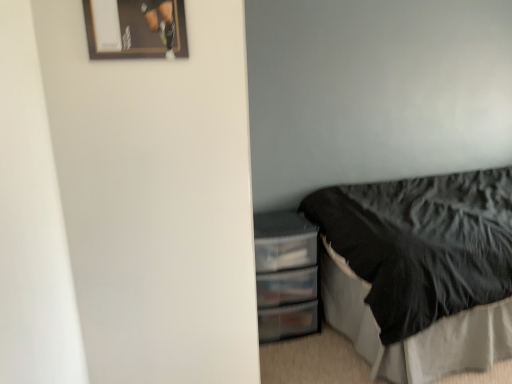
This screenshot has height=384, width=512. Find the location of `transparent plastic drawers at lower right`. transparent plastic drawers at lower right is located at coordinates (286, 275).

Looking at this image, measure the distance between transparent plastic drawers at lower right and camera.

A distance of 2.10 meters exists between transparent plastic drawers at lower right and camera.

I want to click on transparent plastic drawers at lower right, so click(x=286, y=275).

Find the location of a particular element. This screenshot has height=384, width=512. picture frame located in front of the transparent plastic drawers at lower right is located at coordinates (136, 29).

From a real-world perspective, who is located lower, transparent plastic drawers at lower right or wooden framed poster at upper left?

transparent plastic drawers at lower right is physically lower.

Which point is more forward, [298,223] or [105,29]?

Positioned in front is point [105,29].

Is wooden framed poster at upper left located within transparent plastic drawers at lower right?

No, wooden framed poster at upper left is located outside of transparent plastic drawers at lower right.

Which of these two, black feathered bed at lower right or wooden framed poster at upper left, is thinner?

wooden framed poster at upper left.

Considering the relative sizes of black feathered bed at lower right and wooden framed poster at upper left in the image provided, is black feathered bed at lower right bigger than wooden framed poster at upper left?

Yes, black feathered bed at lower right is bigger than wooden framed poster at upper left.

Considering the relative sizes of black feathered bed at lower right and wooden framed poster at upper left in the image provided, is black feathered bed at lower right shorter than wooden framed poster at upper left?

No.

From the image's perspective, between black feathered bed at lower right and transparent plastic drawers at lower right, who is located below?

transparent plastic drawers at lower right.

Does black feathered bed at lower right have a smaller size compared to transparent plastic drawers at lower right?

Incorrect, black feathered bed at lower right is not smaller in size than transparent plastic drawers at lower right.

Does black feathered bed at lower right touch transparent plastic drawers at lower right?

No, black feathered bed at lower right is not in contact with transparent plastic drawers at lower right.

Can you confirm if black feathered bed at lower right is positioned to the right of transparent plastic drawers at lower right?

Indeed, black feathered bed at lower right is positioned on the right side of transparent plastic drawers at lower right.

Is wooden framed poster at upper left spatially inside black feathered bed at lower right, or outside of it?

wooden framed poster at upper left is not enclosed by black feathered bed at lower right.

Which is more to the left, wooden framed poster at upper left or black feathered bed at lower right?

wooden framed poster at upper left is more to the left.

Is wooden framed poster at upper left oriented away from black feathered bed at lower right?

No, black feathered bed at lower right is not at the back of wooden framed poster at upper left.

Which is closer, (102,39) or (482,264)?

The point (102,39) is more forward.

Locate an element on the screen. This screenshot has width=512, height=384. file cabinet below the wooden framed poster at upper left (from a real-world perspective) is located at coordinates (286, 275).

Is there a large distance between wooden framed poster at upper left and transparent plastic drawers at lower right?

Absolutely, wooden framed poster at upper left is distant from transparent plastic drawers at lower right.

Could you tell me if wooden framed poster at upper left is facing transparent plastic drawers at lower right?

No, wooden framed poster at upper left is not facing towards transparent plastic drawers at lower right.

Between wooden framed poster at upper left and transparent plastic drawers at lower right, which one has larger width?

transparent plastic drawers at lower right.

From the picture: From the image's perspective, is transparent plastic drawers at lower right below black feathered bed at lower right?

Yes.

From a real-world perspective, relative to black feathered bed at lower right, is transparent plastic drawers at lower right vertically above or below?

transparent plastic drawers at lower right is below black feathered bed at lower right.

How different are the orientations of transparent plastic drawers at lower right and black feathered bed at lower right in degrees?

transparent plastic drawers at lower right and black feathered bed at lower right are facing 87.1 degrees away from each other.

This screenshot has height=384, width=512. In order to click on picture frame above the transparent plastic drawers at lower right (from a real-world perspective) in this screenshot , I will do `click(136, 29)`.

This screenshot has height=384, width=512. Find the location of `bed on the right of wooden framed poster at upper left`. bed on the right of wooden framed poster at upper left is located at coordinates (421, 271).

Which object lies further to the anchor point transparent plastic drawers at lower right, wooden framed poster at upper left or black feathered bed at lower right?

wooden framed poster at upper left is positioned further to the anchor transparent plastic drawers at lower right.

Which object lies nearer to the anchor point wooden framed poster at upper left, black feathered bed at lower right or transparent plastic drawers at lower right?

Among the two, transparent plastic drawers at lower right is located nearer to wooden framed poster at upper left.

Looking at the image, which one is located further to wooden framed poster at upper left, transparent plastic drawers at lower right or black feathered bed at lower right?

Among the two, black feathered bed at lower right is located further to wooden framed poster at upper left.

Considering their positions, is wooden framed poster at upper left positioned further to black feathered bed at lower right than transparent plastic drawers at lower right?

wooden framed poster at upper left is further to black feathered bed at lower right.

Looking at the image, which one is located further to transparent plastic drawers at lower right, black feathered bed at lower right or wooden framed poster at upper left?

Based on the image, wooden framed poster at upper left appears to be further to transparent plastic drawers at lower right.

Based on their spatial positions, is transparent plastic drawers at lower right or wooden framed poster at upper left closer to black feathered bed at lower right?

transparent plastic drawers at lower right is positioned closer to the anchor black feathered bed at lower right.

Identify the location of file cabinet between wooden framed poster at upper left and black feathered bed at lower right from left to right. The width and height of the screenshot is (512, 384). pos(286,275).